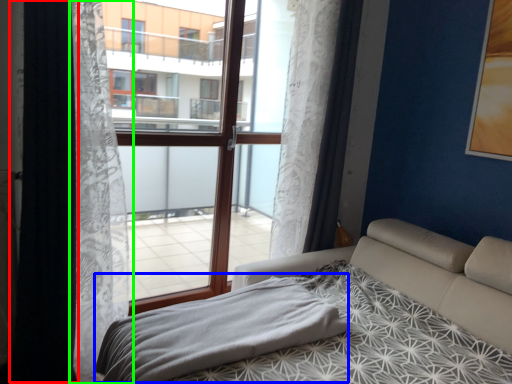
Question: Considering the real-world distances, which object is closest to curtain (highlighted by a red box)? blanket (highlighted by a blue box) or curtain (highlighted by a green box).

Choices:
 (A) blanket
 (B) curtain

Answer: (B)